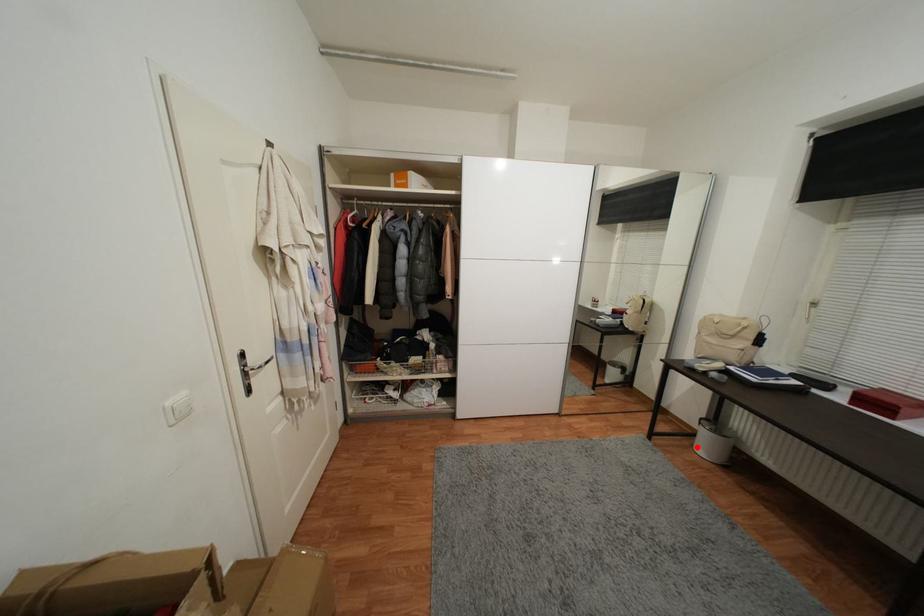
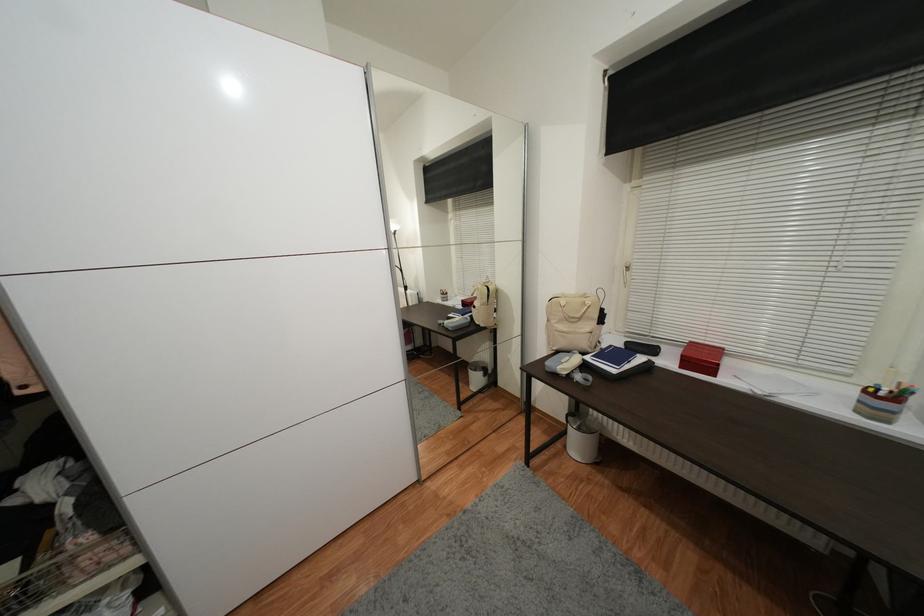
Find the pixel in the second image that matches the highlighted location in the first image.

(569, 448)